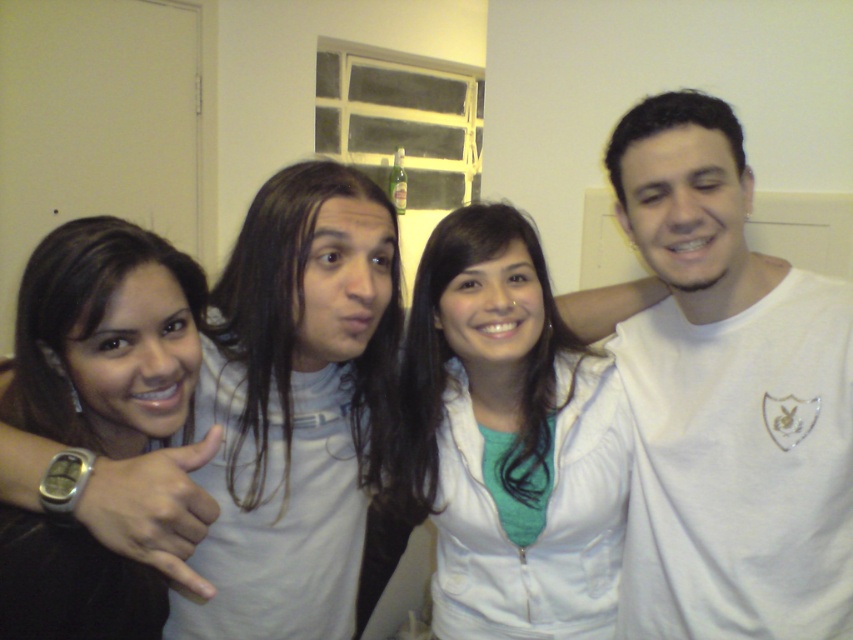
Question: Is the position of white matte t-shirt at center less distant than that of white matte jacket at center?

Choices:
 (A) yes
 (B) no

Answer: (A)

Question: Is white matte t-shirt at center thinner than white matte jacket at center?

Choices:
 (A) yes
 (B) no

Answer: (A)

Question: Can you confirm if white matte t-shirt at center is smaller than brown hair at upper left?

Choices:
 (A) no
 (B) yes

Answer: (A)

Question: Which point is closer to the camera?

Choices:
 (A) (521, 490)
 (B) (740, 426)
 (C) (144, 604)

Answer: (C)

Question: Which point is closer to the camera taking this photo?

Choices:
 (A) (643, 134)
 (B) (550, 294)
 (C) (49, 380)

Answer: (C)

Question: Which point is farther from the camera taking this photo?

Choices:
 (A) (154, 396)
 (B) (416, 403)
 (C) (648, 333)

Answer: (C)